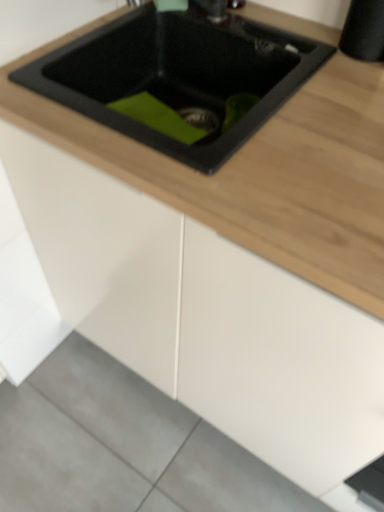
Question: Does gray concrete at lower left touch black matte sink at upper center?

Choices:
 (A) no
 (B) yes

Answer: (A)

Question: Does gray concrete at lower left have a greater height compared to black matte sink at upper center?

Choices:
 (A) yes
 (B) no

Answer: (B)

Question: From a real-world perspective, is gray concrete at lower left below black matte sink at upper center?

Choices:
 (A) no
 (B) yes

Answer: (B)

Question: Can you confirm if gray concrete at lower left is bigger than black matte sink at upper center?

Choices:
 (A) yes
 (B) no

Answer: (B)

Question: Is gray concrete at lower left oriented away from black matte sink at upper center?

Choices:
 (A) yes
 (B) no

Answer: (B)

Question: Does gray concrete at lower left appear on the left side of black matte sink at upper center?

Choices:
 (A) yes
 (B) no

Answer: (A)

Question: Is black matte sink at upper center oriented towards gray concrete at lower left?

Choices:
 (A) yes
 (B) no

Answer: (B)

Question: Is black matte sink at upper center facing away from gray concrete at lower left?

Choices:
 (A) no
 (B) yes

Answer: (A)

Question: Does black matte sink at upper center come in front of gray concrete at lower left?

Choices:
 (A) no
 (B) yes

Answer: (B)

Question: Considering the relative sizes of black matte sink at upper center and gray concrete at lower left in the image provided, is black matte sink at upper center smaller than gray concrete at lower left?

Choices:
 (A) yes
 (B) no

Answer: (B)

Question: From the image's perspective, is black matte sink at upper center above gray concrete at lower left?

Choices:
 (A) no
 (B) yes

Answer: (B)

Question: From the image's perspective, is black matte sink at upper center located beneath gray concrete at lower left?

Choices:
 (A) no
 (B) yes

Answer: (A)

Question: Considering the positions of black matte sink at upper center and gray concrete at lower left in the image, is black matte sink at upper center bigger or smaller than gray concrete at lower left?

Choices:
 (A) big
 (B) small

Answer: (A)